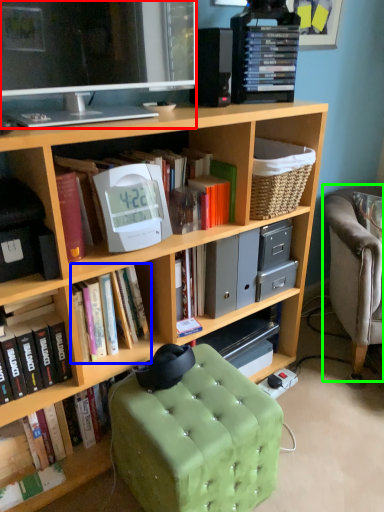
Question: Considering the real-world distances, which object is farthest from television (highlighted by a red box)? book (highlighted by a blue box) or chair (highlighted by a green box)?

Choices:
 (A) book
 (B) chair

Answer: (B)